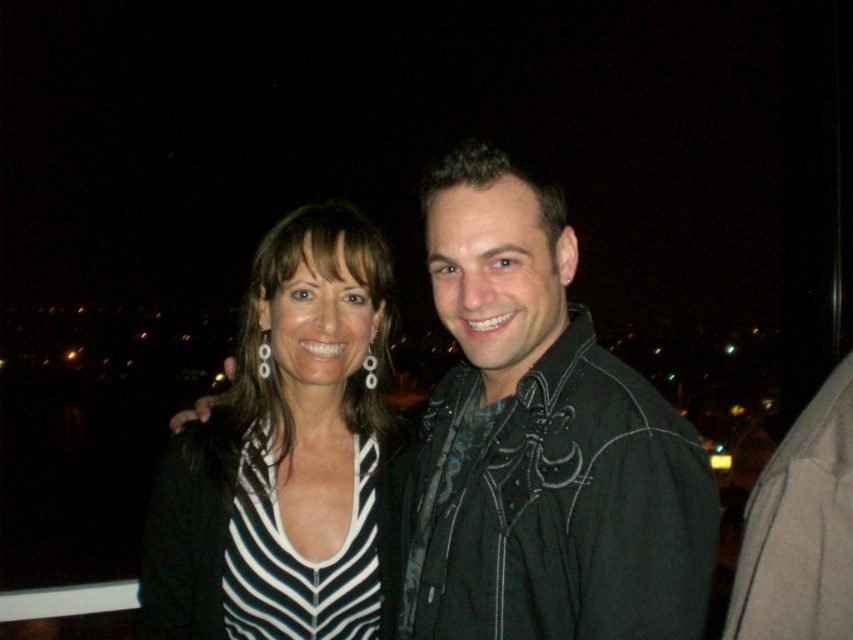
You are a photographer setting up a camera to capture the scene described. You notice two items of clothing at the center of the image. Which clothing item is taller between the black leather jacket at center and the striped fabric top at center?

The black leather jacket at center is taller than the striped fabric top at center according to the description.

You are a photographer taking a portrait of two people standing against a dark background. You notice the black leather jacket at center and the striped fabric top at center. Which clothing item is positioned higher on the subjects?

The black leather jacket at center is positioned higher than the striped fabric top at center.

You are standing in front of the image and want to determine which of the two points, point (451, 557) or point (331, 576), is nearer to you. Based on the scene, which point is closer?

Point (451, 557) is closer to the viewer than point (331, 576).